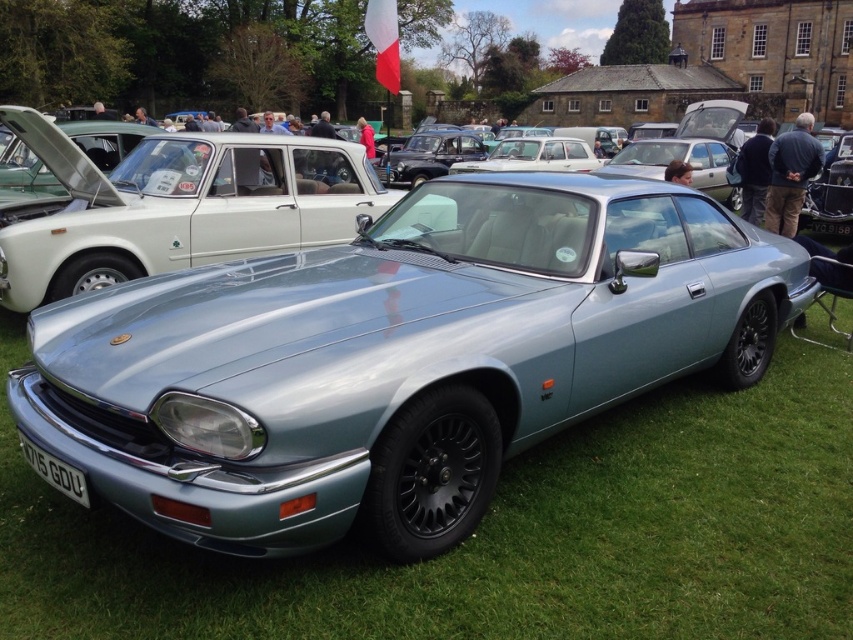
Is satin silver metallic car at center further to camera compared to white plastic license plate at front?

Yes, satin silver metallic car at center is behind white plastic license plate at front.

Based on the photo, does satin silver metallic car at center appear on the left side of white plastic license plate at front?

Correct, you'll find satin silver metallic car at center to the left of white plastic license plate at front.

Between point (97, 246) and point (44, 461), which one is positioned behind?

The point (97, 246) is behind.

This screenshot has height=640, width=853. I want to click on satin silver metallic car at center, so click(187, 211).